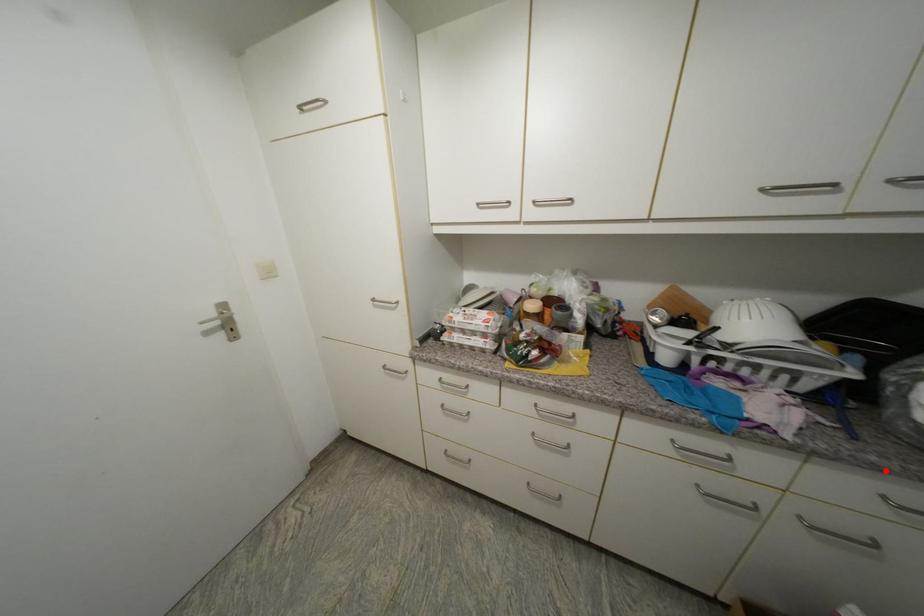
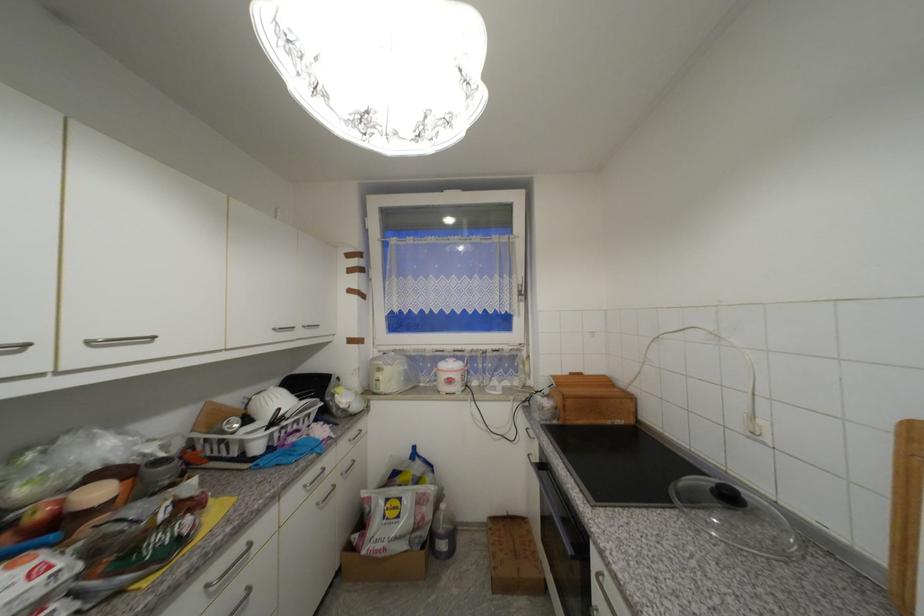
In the second image, find the point that corresponds to the highlighted location in the first image.

(354, 430)